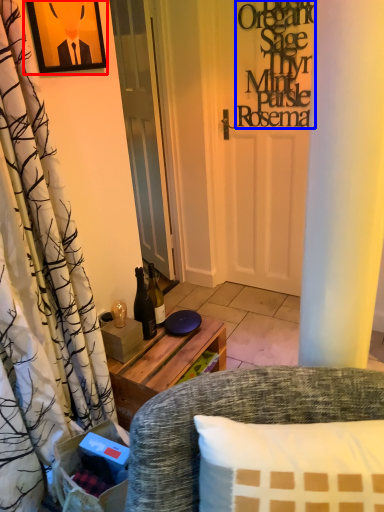
Question: Which object appears farthest to the camera in this image, picture frame (highlighted by a red box) or writing (highlighted by a blue box)?

Choices:
 (A) picture frame
 (B) writing

Answer: (B)